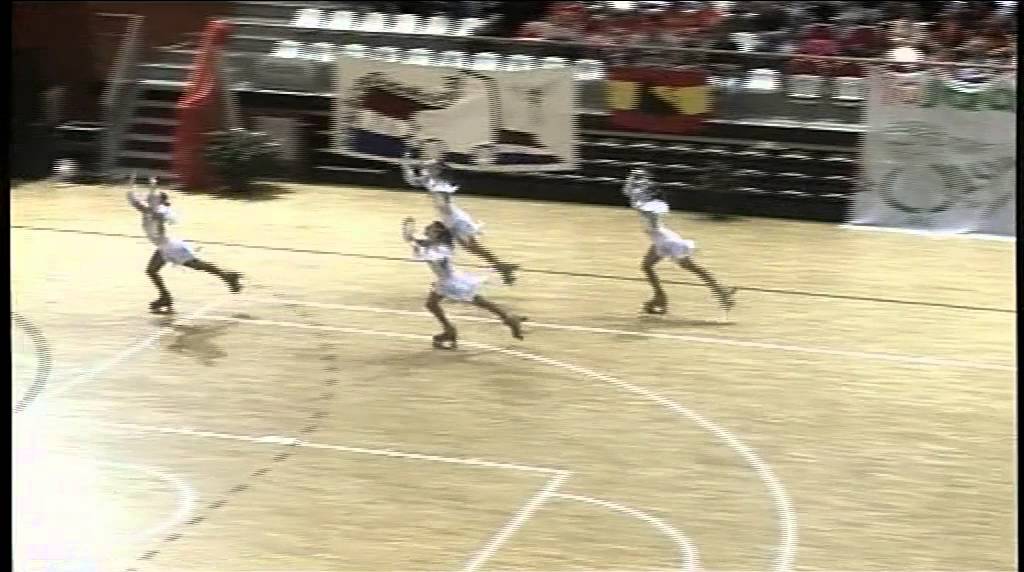
Identify the location of stairs. (154, 132).